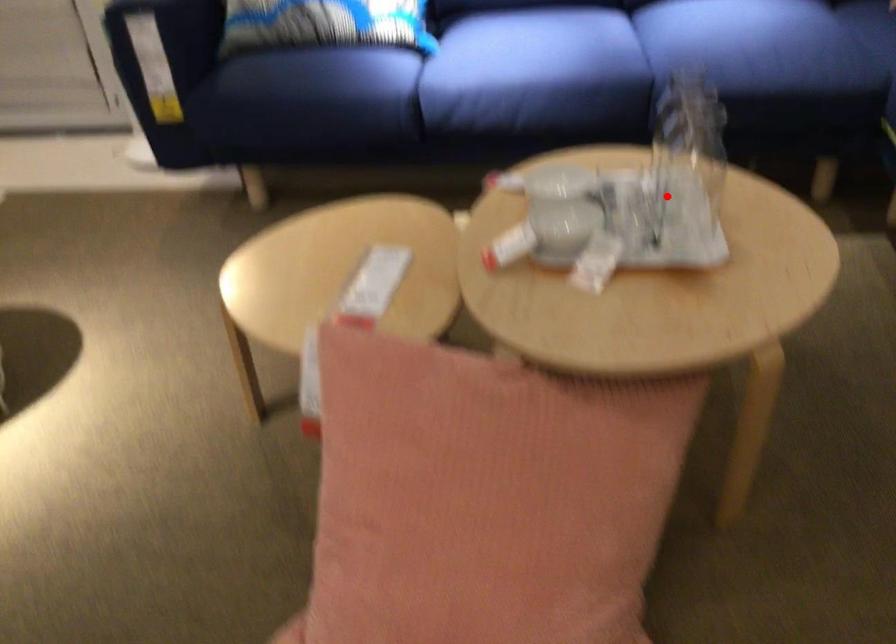
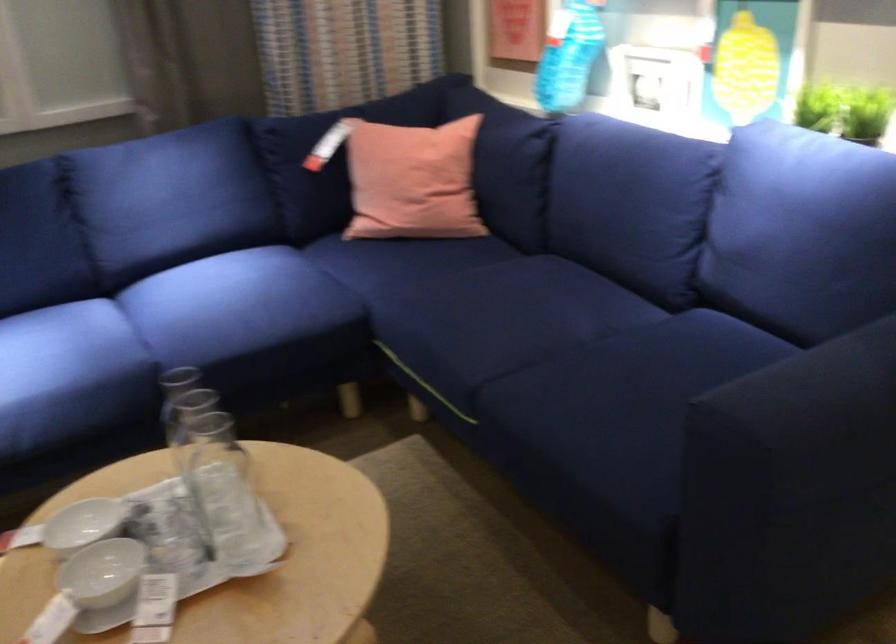
Locate, in the second image, the point that corresponds to the highlighted location in the first image.

(222, 491)